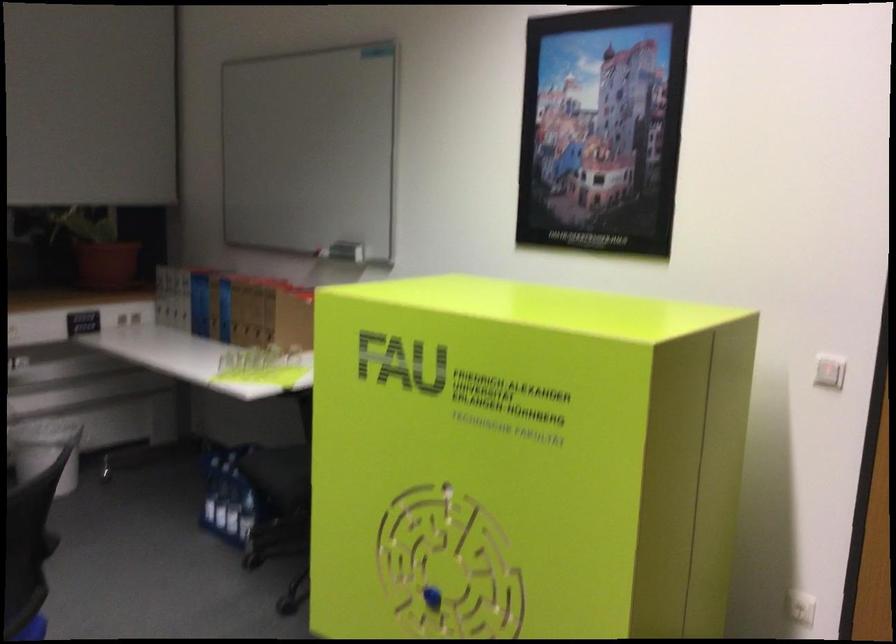
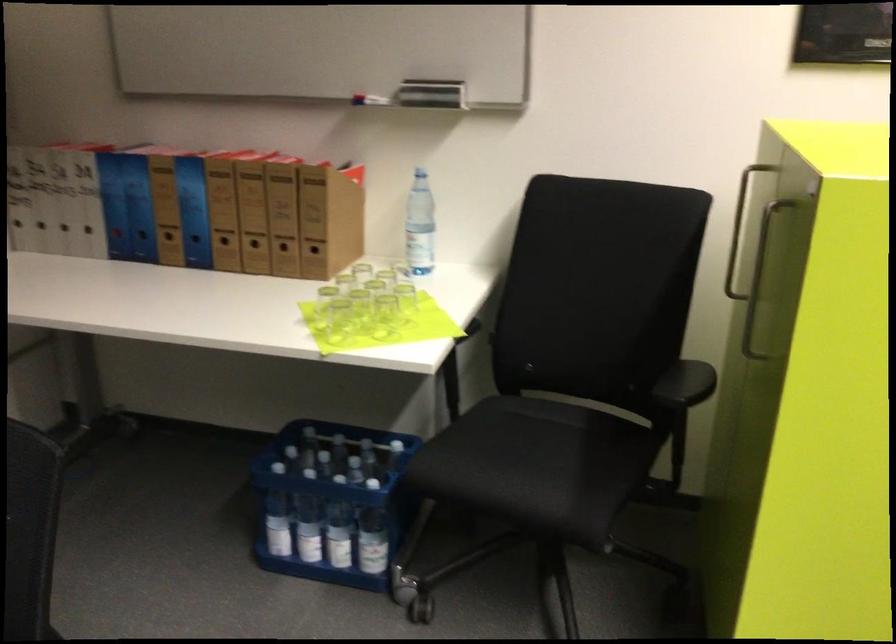
Looking at this image, what movement of the cameraman would produce the second image?

The cameraman walked toward left, forward.